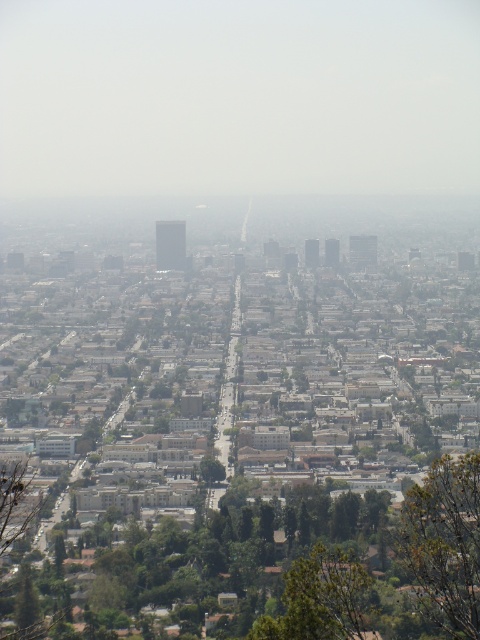
You are a drone operator flying a drone over the city. Your drone is currently above the green leafy tree at lower right and the green leafy tree at lower center. Which tree is closer to your drone?

The green leafy tree at lower right is closer to your drone because it is in front of the green leafy tree at lower center.

You are a city planner reviewing an aerial map of the urban area. You notice the green leafy tree at lower right. Based on its position, can you determine if it is closer to the edge of the image or the center?

The green leafy tree at lower right is located at point [444,544], which places it closer to the edge of the image rather than the center.